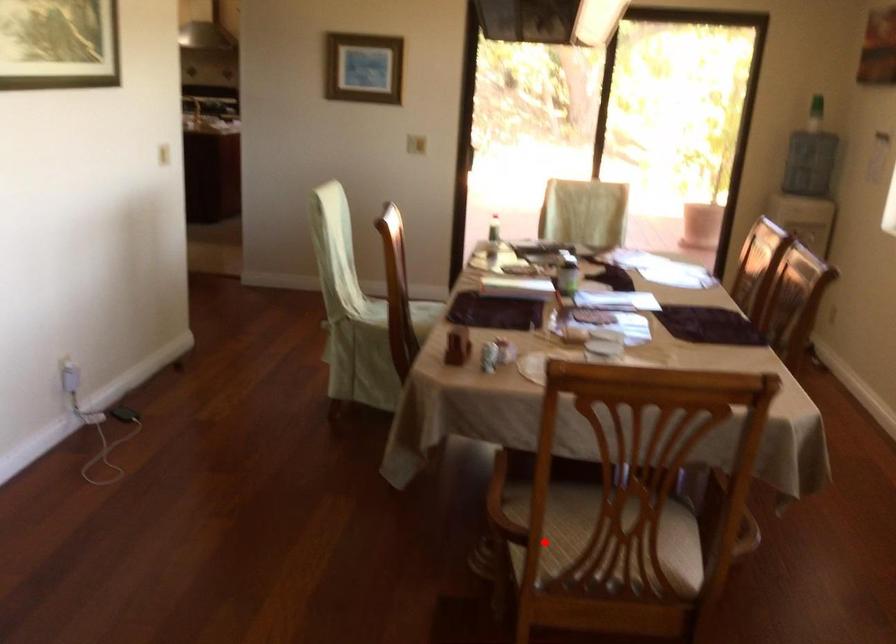
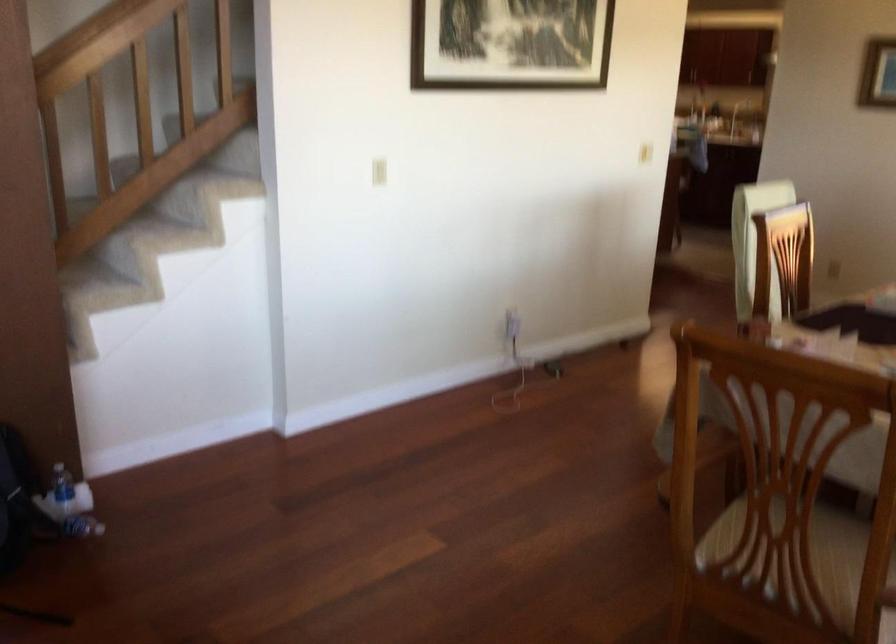
Find the pixel in the second image that matches the highlighted location in the first image.

(736, 532)